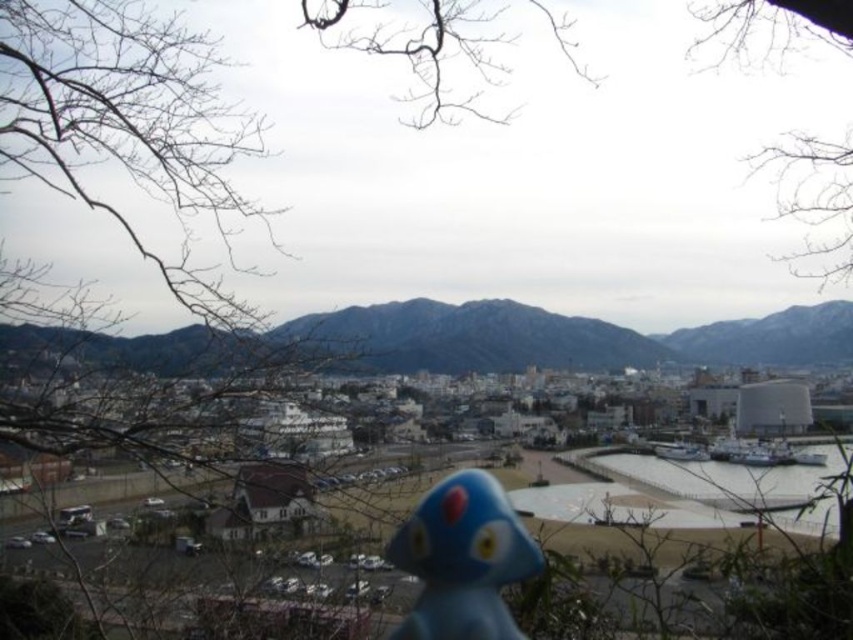
Does gray rocky mountain at center appear on the right side of blue matte figurine at center?

Correct, you'll find gray rocky mountain at center to the right of blue matte figurine at center.

Does gray rocky mountain at center have a larger size compared to blue matte figurine at center?

Yes.

Is point (180, 332) more distant than point (451, 580)?

Yes, it is.

Locate an element on the screen. Image resolution: width=853 pixels, height=640 pixels. gray rocky mountain at center is located at coordinates (561, 337).

Which is behind, point (801, 360) or point (438, 60)?

Point (801, 360)

Who is shorter, gray rocky mountain at center or bare branches at upper center?

gray rocky mountain at center

Is point (396, 358) farther from camera compared to point (819, 8)?

Yes.

Identify the location of gray rocky mountain at center. (561, 337).

Who is positioned more to the right, bare branches at upper center or blue matte figurine at center?

bare branches at upper center is more to the right.

Who is taller, bare branches at upper center or blue matte figurine at center?

With more height is bare branches at upper center.

I want to click on bare branches at upper center, so click(x=433, y=48).

Find the location of `bare branches at upper center`. bare branches at upper center is located at coordinates (433, 48).